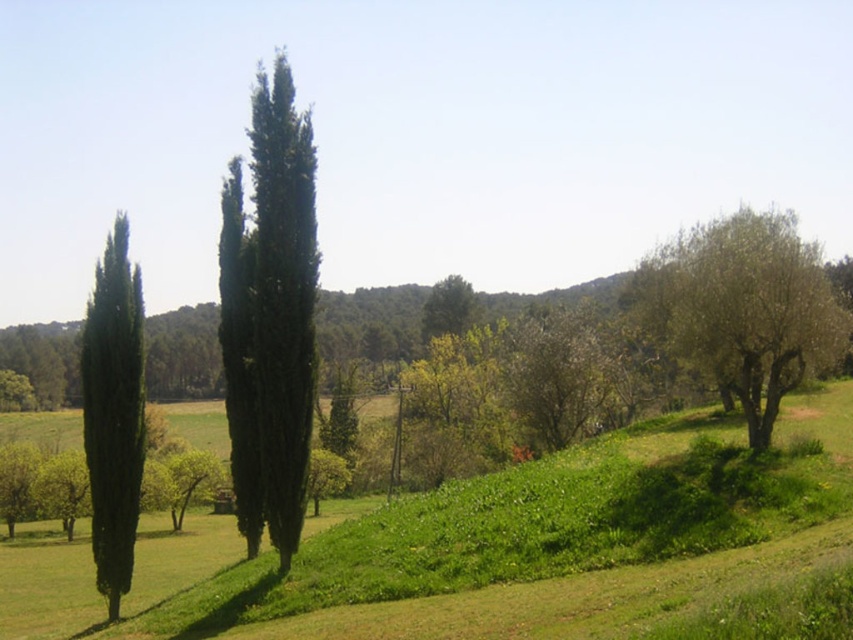
Is green textured cypress at center to the left of green matte cypress at left from the viewer's perspective?

In fact, green textured cypress at center is to the right of green matte cypress at left.

Is green textured cypress at center bigger than green matte cypress at left?

Yes.

Which is in front, point (306, 404) or point (106, 355)?

Point (306, 404)

Identify the location of green textured cypress at center. Image resolution: width=853 pixels, height=640 pixels. (270, 316).

Who is more distant from viewer, (x=782, y=524) or (x=143, y=448)?

Positioned behind is point (x=143, y=448).

Who is more forward, (x=160, y=564) or (x=126, y=420)?

Point (x=126, y=420) is in front.

Is point (630, 433) more distant than point (134, 355)?

Yes, it is behind point (134, 355).

At what (x,y) coordinates should I click in order to perform the action: click on green grassy hillside at center. Please return your answer as a coordinate pair (x, y). The width and height of the screenshot is (853, 640). Looking at the image, I should click on (479, 548).

Can you confirm if green textured cypress at center is taller than green leafy tree at right?

Yes.

This screenshot has height=640, width=853. Find the location of `green textured cypress at center`. green textured cypress at center is located at coordinates (270, 316).

Is point (287, 93) positioned before point (772, 314)?

No, it is not.

The height and width of the screenshot is (640, 853). I want to click on green textured cypress at center, so click(x=270, y=316).